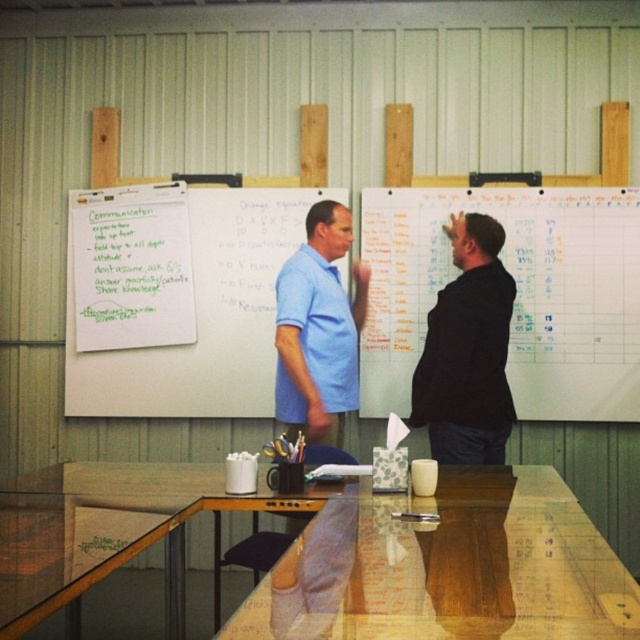
Question: Does transparent glass table at center appear on the left side of black matte shirt at center?

Choices:
 (A) yes
 (B) no

Answer: (A)

Question: Among these objects, which one is nearest to the camera?

Choices:
 (A) black matte shirt at center
 (B) transparent glass table at lower left
 (C) light blue cotton shirt at center
 (D) whiteboard at upper right

Answer: (B)

Question: Among these objects, which one is farthest from the camera?

Choices:
 (A) light blue cotton shirt at center
 (B) transparent glass table at lower left
 (C) black matte shirt at center
 (D) whiteboard at upper right

Answer: (D)

Question: Considering the real-world distances, which object is farthest from the whiteboard at upper right?

Choices:
 (A) transparent glass table at lower left
 (B) white paperboard at upper left

Answer: (A)

Question: Is white paperboard at upper left thinner than black matte shirt at center?

Choices:
 (A) no
 (B) yes

Answer: (A)

Question: Does black matte shirt at center have a smaller size compared to light blue cotton shirt at center?

Choices:
 (A) no
 (B) yes

Answer: (A)